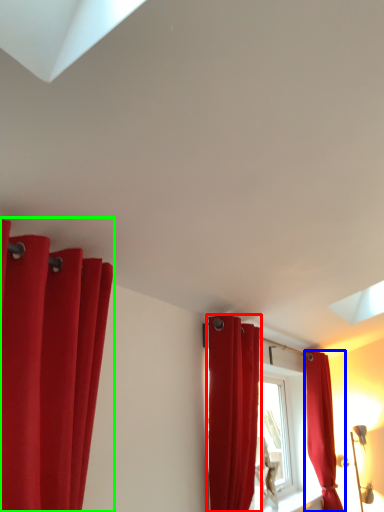
Question: Considering the real-world distances, which object is farthest from curtain (highlighted by a red box)? curtain (highlighted by a blue box) or curtain (highlighted by a green box)?

Choices:
 (A) curtain
 (B) curtain

Answer: (A)